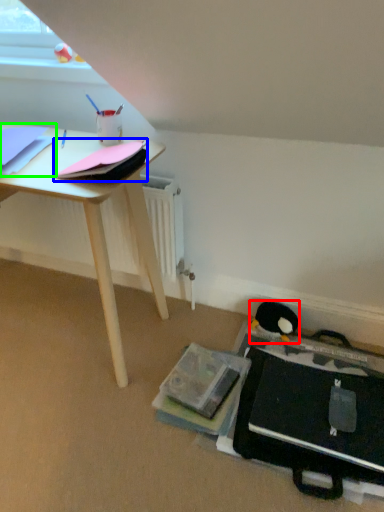
Question: Based on their relative distances, which object is nearer to penguin (highlighted by a red box)? Choose from paperback book (highlighted by a blue box) and paperback book (highlighted by a green box).

Choices:
 (A) paperback book
 (B) paperback book

Answer: (A)